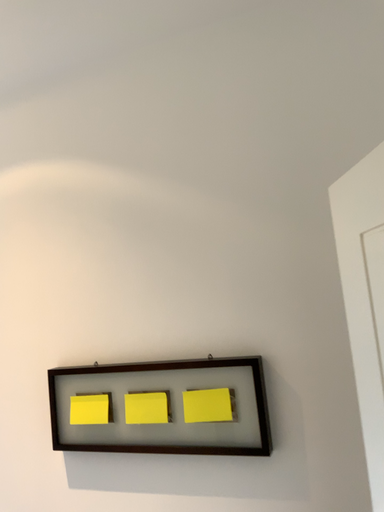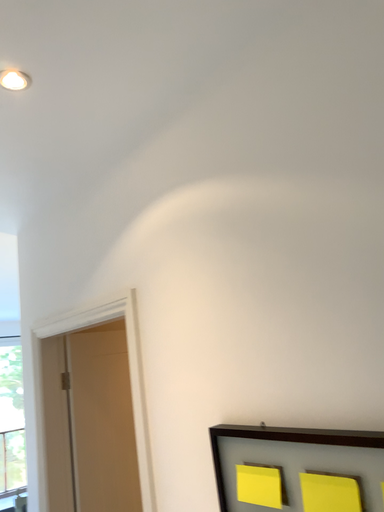
Question: How did the camera likely rotate when shooting the video?

Choices:
 (A) rotated right
 (B) rotated left

Answer: (B)